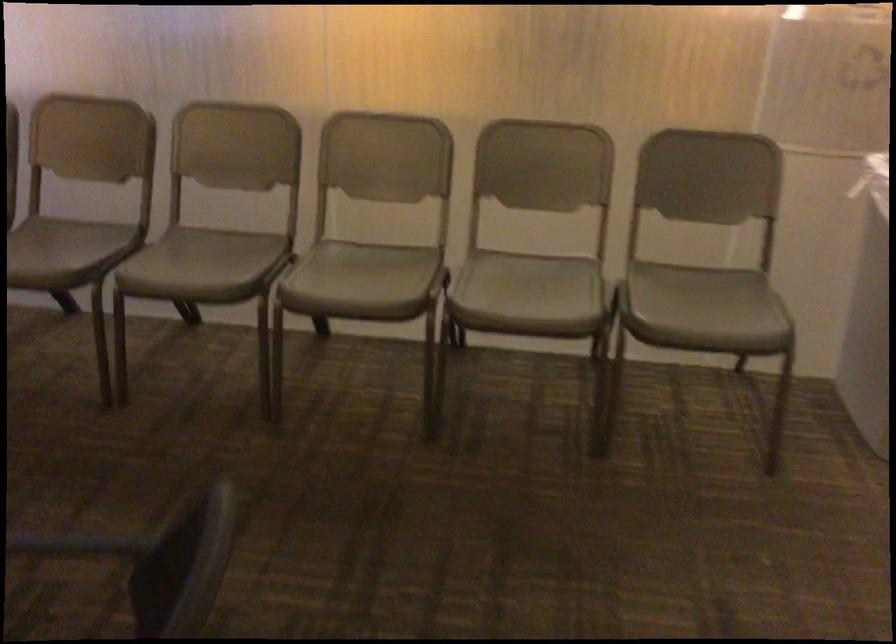
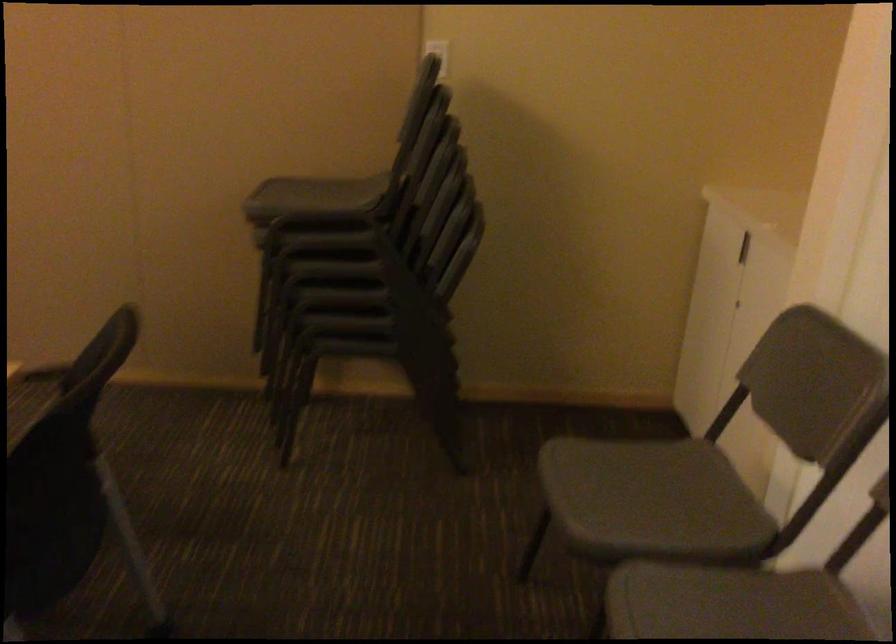
The first image is from the beginning of the video and the second image is from the end. How did the camera likely rotate when shooting the video?

The camera rotated toward right-down.